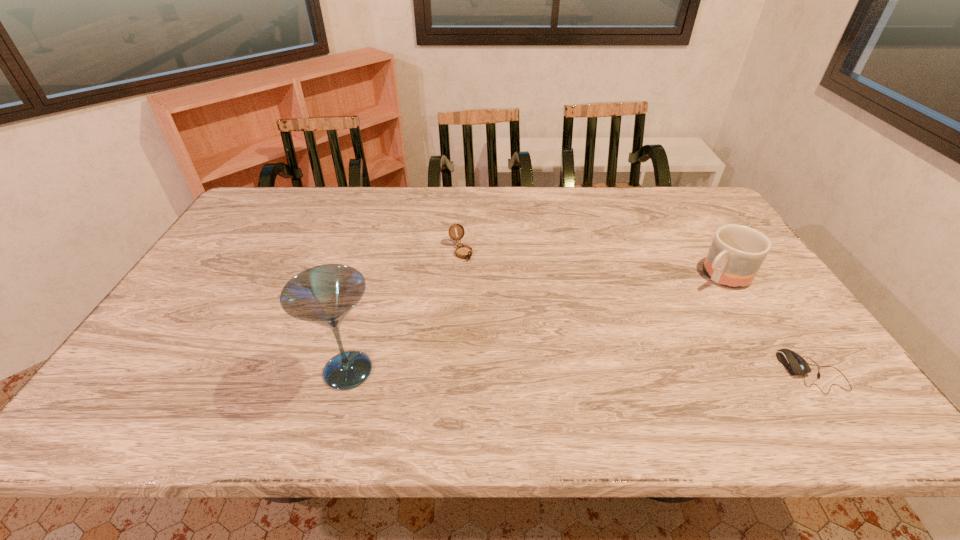
This screenshot has width=960, height=540. In order to click on free space between the third shortest object and the tallest object in this screenshot , I will do `click(535, 323)`.

Identify the location of free space that is in between the martini and the mug. This screenshot has height=540, width=960. (535, 323).

I want to click on free space between the second tallest object and the martini, so click(535, 323).

Identify which object is the third nearest to the compass. Please provide its 2D coordinates. Your answer should be formatted as a tuple, i.e. [(x, y)], where the tuple contains the x and y coordinates of a point satisfying the conditions above.

[(796, 365)]

I want to click on the third closest object to the third tallest object, so click(x=796, y=365).

Identify the location of vacant point that satisfies the following two spatial constraints: 1. on the back side of the mug; 2. on the left side of the martini. (374, 275).

Image resolution: width=960 pixels, height=540 pixels. Identify the location of vacant space that satisfies the following two spatial constraints: 1. on the front side of the third object from right to left; 2. on the right side of the mug. (460, 275).

Locate an element on the screen. vacant space that satisfies the following two spatial constraints: 1. on the front side of the tallest object; 2. on the left side of the shortest object is located at coordinates (348, 372).